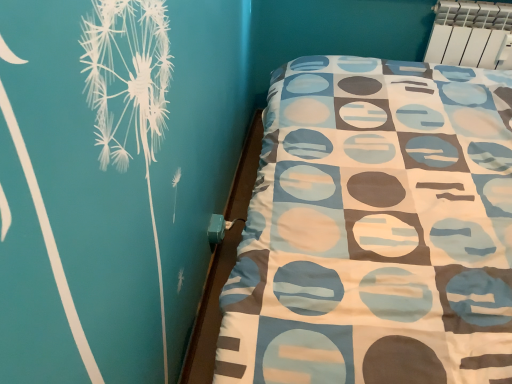
Image resolution: width=512 pixels, height=384 pixels. Describe the element at coordinates (471, 34) in the screenshot. I see `white plastic radiator at upper right` at that location.

What is the approximate width of white plastic radiator at upper right?

4.93 inches.

Identify the location of white plastic radiator at upper right. Image resolution: width=512 pixels, height=384 pixels. (471, 34).

Describe the element at coordinates (222, 263) in the screenshot. I see `teal plastic bed frame at lower right` at that location.

The image size is (512, 384). I want to click on teal plastic bed frame at lower right, so click(x=222, y=263).

In order to click on white plastic radiator at upper right in this screenshot , I will do `click(471, 34)`.

Visually, is teal plastic bed frame at lower right positioned to the left or to the right of white plastic radiator at upper right?

From the image, it's evident that teal plastic bed frame at lower right is to the left of white plastic radiator at upper right.

In the image, is teal plastic bed frame at lower right positioned in front of or behind white plastic radiator at upper right?

teal plastic bed frame at lower right is positioned closer to the viewer than white plastic radiator at upper right.

Which point is more forward, (206,282) or (445,13)?

Point (206,282)

From the image's perspective, is teal plastic bed frame at lower right above or below white plastic radiator at upper right?

Clearly, from the image's perspective, teal plastic bed frame at lower right is below white plastic radiator at upper right.

From a real-world perspective, is teal plastic bed frame at lower right physically above white plastic radiator at upper right?

Actually, teal plastic bed frame at lower right is physically below white plastic radiator at upper right in the real world.

Which of these two, teal plastic bed frame at lower right or white plastic radiator at upper right, is wider?

Wider between the two is white plastic radiator at upper right.

Which of these two, teal plastic bed frame at lower right or white plastic radiator at upper right, stands shorter?

With less height is teal plastic bed frame at lower right.

Which of these two, teal plastic bed frame at lower right or white plastic radiator at upper right, is smaller?

teal plastic bed frame at lower right.

Do you think teal plastic bed frame at lower right is within white plastic radiator at upper right, or outside of it?

The correct answer is: outside.

Is teal plastic bed frame at lower right far away from white plastic radiator at upper right?

teal plastic bed frame at lower right is positioned a significant distance from white plastic radiator at upper right.

Is teal plastic bed frame at lower right facing towards white plastic radiator at upper right?

No, teal plastic bed frame at lower right is not turned towards white plastic radiator at upper right.

How different are the orientations of teal plastic bed frame at lower right and white plastic radiator at upper right in degrees?

There is a 90.5-degree angle between the facing directions of teal plastic bed frame at lower right and white plastic radiator at upper right.

Identify the location of radiator located behind the teal plastic bed frame at lower right. (471, 34).

Based on their positions, is white plastic radiator at upper right located to the left or right of teal plastic bed frame at lower right?

Clearly, white plastic radiator at upper right is on the right of teal plastic bed frame at lower right in the image.

Which object is closer to the camera, white plastic radiator at upper right or teal plastic bed frame at lower right?

teal plastic bed frame at lower right.

Is point (471, 29) closer to camera compared to point (216, 346)?

No.

From the image's perspective, is white plastic radiator at upper right below teal plastic bed frame at lower right?

No, from the image's perspective, white plastic radiator at upper right is not beneath teal plastic bed frame at lower right.

From a real-world perspective, which is physically above, white plastic radiator at upper right or teal plastic bed frame at lower right?

In real-world perspective, white plastic radiator at upper right is above.

In terms of width, does white plastic radiator at upper right look wider or thinner when compared to teal plastic bed frame at lower right?

white plastic radiator at upper right is wider than teal plastic bed frame at lower right.

Does white plastic radiator at upper right have a greater height compared to teal plastic bed frame at lower right?

Correct, white plastic radiator at upper right is much taller as teal plastic bed frame at lower right.

In the scene shown: Considering the sizes of objects white plastic radiator at upper right and teal plastic bed frame at lower right in the image provided, who is smaller, white plastic radiator at upper right or teal plastic bed frame at lower right?

teal plastic bed frame at lower right is smaller.

Is white plastic radiator at upper right situated inside teal plastic bed frame at lower right or outside?

white plastic radiator at upper right is not enclosed by teal plastic bed frame at lower right.

Is white plastic radiator at upper right touching teal plastic bed frame at lower right?

No, white plastic radiator at upper right is not touching teal plastic bed frame at lower right.

Is white plastic radiator at upper right turned away from teal plastic bed frame at lower right?

No, white plastic radiator at upper right is not facing the opposite direction of teal plastic bed frame at lower right.

This screenshot has height=384, width=512. I want to click on bed frame below the white plastic radiator at upper right (from the image's perspective), so click(222, 263).

Locate an element on the screen. The height and width of the screenshot is (384, 512). radiator above the teal plastic bed frame at lower right (from the image's perspective) is located at coordinates (471, 34).

Locate an element on the screen. Image resolution: width=512 pixels, height=384 pixels. radiator on the right of teal plastic bed frame at lower right is located at coordinates (471, 34).